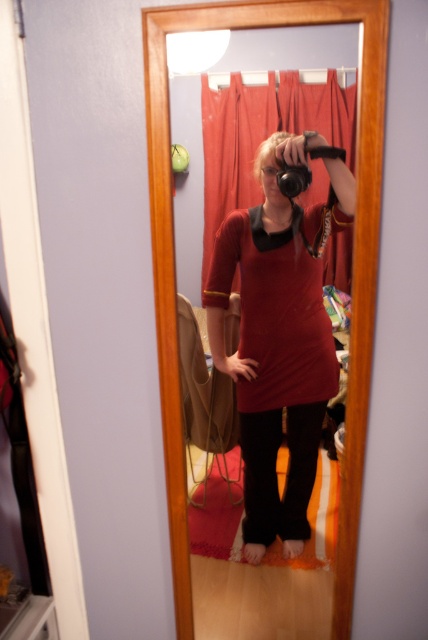
You are trying to determine the position of the matte red dress at center in the bathroom scene. What are its coordinates?

The matte red dress at center is located at coordinates [275,355].

You are trying to locate the matte red dress at center in the bathroom scene. According to the coordinates provided, where would you look to find it?

The matte red dress at center is located at coordinates point (275, 355).

You are standing in the bathroom and want to take a selfie using the mirror. The camera you are holding is at position point A. The reflection of the matte red dress at center in the mirror is at position point B. According to the coordinates provided, is point B closer to the camera than point A?

The coordinates of the matte red dress at center are at point B, which is the reflection in the mirror. Since reflections in mirrors are virtual images located behind the mirror at the same distance as the object is in front, point B would be as far from the mirror as point A. Therefore, the distance between the camera at point A and point B would be twice the distance from the camera to the mirror. Thus, point B is not closer to the camera than point A.